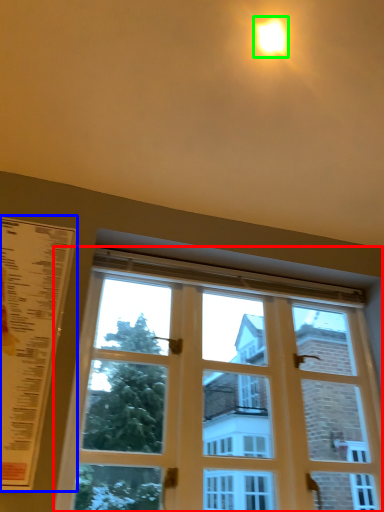
Question: Estimate the real-world distances between objects in this image. Which object is farther from window (highlighted by a red box), menu (highlighted by a blue box) or light (highlighted by a green box)?

Choices:
 (A) menu
 (B) light

Answer: (B)